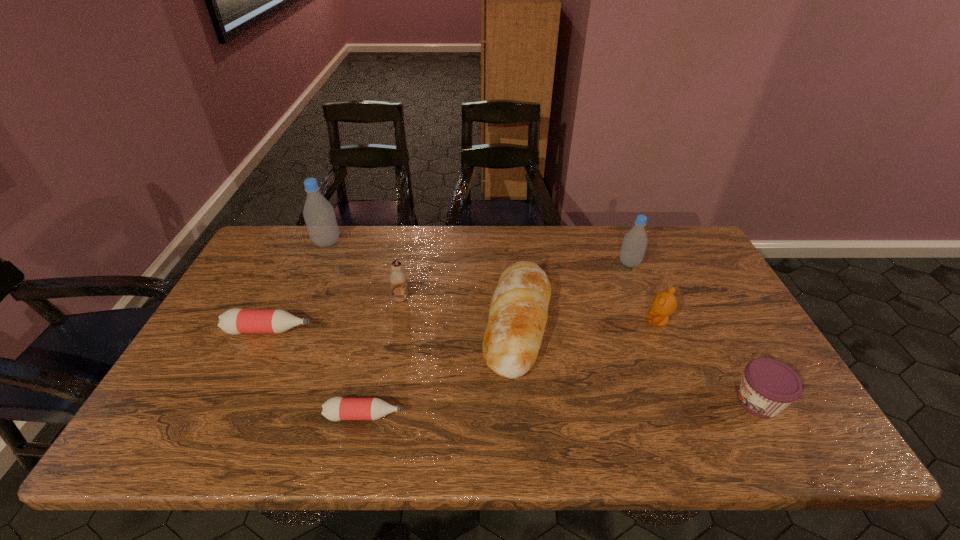
What are the coordinates of `the second shortest bottle` in the screenshot? It's located at (235, 321).

The width and height of the screenshot is (960, 540). I want to click on the seventh tallest object, so click(x=235, y=321).

Find the location of a particular element. The image size is (960, 540). the nearer pink bottle is located at coordinates (337, 408).

Locate an element on the screen. the nearest bottle is located at coordinates (337, 408).

The image size is (960, 540). I want to click on free spot located 0.090m on the right of the left gray bottle, so click(367, 242).

At what (x,y) coordinates should I click in order to perform the action: click on free point located 0.350m on the front of the seventh shortest object. Please return your answer as a coordinate pair (x, y). This screenshot has width=960, height=540. Looking at the image, I should click on (667, 358).

Locate an element on the screen. This screenshot has height=540, width=960. vacant region located on the left of the chocolate milk is located at coordinates (370, 299).

The width and height of the screenshot is (960, 540). Identify the location of free spot located 0.280m on the right of the fourth object from right to left. (654, 323).

At what (x,y) coordinates should I click in order to perform the action: click on vacant space located 0.320m on the face of the teddy bear. Please return your answer as a coordinate pair (x, y). Looking at the image, I should click on (531, 321).

What are the coordinates of `free space located on the face of the teddy bear` in the screenshot? It's located at (617, 321).